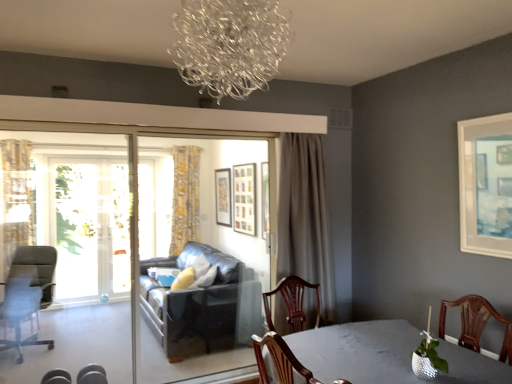
What is the approximate height of black leather couch at center, which is the 2th screen door in front-to-back order?

black leather couch at center, which is the 2th screen door in front-to-back order, is 6.60 feet tall.

Find the location of `leather couch at center`. leather couch at center is located at coordinates (202, 305).

Measure the distance between point (255, 177) and camera.

A distance of 15.72 feet exists between point (255, 177) and camera.

How much space does transparent glass screen door at left, which is counted as the 2th screen door, starting from the left, occupy vertically?

1.90 meters.

Identify the location of black leather couch at center, which is the 2th screen door in front-to-back order. (199, 258).

Which is more to the right, matte black chair at lower left, which is counted as the 2th chair, starting from the left, or yellow floral fabric curtain at left, positioned as the 3th curtain in right-to-left order?

Positioned to the right is matte black chair at lower left, which is counted as the 2th chair, starting from the left.

Where is `chair that is the 2nd object located below the yellow floral fabric curtain at left, positioned as the 3th curtain in right-to-left order (from the image's perspective)`? This screenshot has width=512, height=384. chair that is the 2nd object located below the yellow floral fabric curtain at left, positioned as the 3th curtain in right-to-left order (from the image's perspective) is located at coordinates (56, 377).

From the image's perspective, is matte black chair at lower left, placed as the second chair when sorted from right to left, on yellow floral fabric curtain at left, which appears as the second curtain when viewed from the back?

No, from the image's perspective, matte black chair at lower left, placed as the second chair when sorted from right to left, is not over yellow floral fabric curtain at left, which appears as the second curtain when viewed from the back.

Does point (45, 379) appear closer or farther from the camera than point (10, 155)?

Point (45, 379) appears to be closer to the viewer than point (10, 155).

Is wooden picture frame at center, which is the 2th picture frame in front-to-back order, far away from black leather couch at center, marked as the 1th screen door in a right-to-left arrangement?

That's right, there is a large distance between wooden picture frame at center, which is the 2th picture frame in front-to-back order, and black leather couch at center, marked as the 1th screen door in a right-to-left arrangement.

Is wooden picture frame at center, which is the 2th picture frame in front-to-back order, taller than black leather couch at center, the second screen door from the back?

No.

From the image's perspective, between wooden picture frame at center, which ranks as the 2th picture frame in right-to-left order, and black leather couch at center, the second screen door from the back, who is located below?

black leather couch at center, the second screen door from the back, appears lower in the image.

Is wooden picture frame at center, the 3th picture frame from the left, to the right of black leather couch at center, which is the 2th screen door in front-to-back order, from the viewer's perspective?

Indeed, wooden picture frame at center, the 3th picture frame from the left, is positioned on the right side of black leather couch at center, which is the 2th screen door in front-to-back order.

Is gray fabric curtain at center, positioned as the 3th curtain in back-to-front order, with leather couch at center?

No, gray fabric curtain at center, positioned as the 3th curtain in back-to-front order, is not making contact with leather couch at center.

From the image's perspective, who appears lower, gray fabric curtain at center, placed as the first curtain when sorted from front to back, or leather couch at center?

leather couch at center is shown below in the image.

Which object is positioned more to the right, gray fabric curtain at center, placed as the first curtain when sorted from front to back, or leather couch at center?

gray fabric curtain at center, placed as the first curtain when sorted from front to back, is more to the right.

There is a leather couch at center. In order to click on the 1st curtain above it (from a real-world perspective) in this screenshot , I will do pos(305,218).

Which object is thinner, leather couch at center or shiny gray table at lower right?

leather couch at center is thinner.

Find the location of a particular element. table to the right of leather couch at center is located at coordinates (386, 355).

In the scene shown: How many degrees apart are the facing directions of leather couch at center and shiny gray table at lower right?

The facing directions of leather couch at center and shiny gray table at lower right are 1.53 degrees apart.

From the image's perspective, who appears lower, wooden picture frame at center, the 3th picture frame from the left, or metallic silver chair at lower left, the 2th chair from the back?

metallic silver chair at lower left, the 2th chair from the back, from the image's perspective.

From the picture: Would you say wooden picture frame at center, the 3th picture frame from the left, is inside or outside metallic silver chair at lower left, the 2th chair from the back?

wooden picture frame at center, the 3th picture frame from the left, is located beyond the bounds of metallic silver chair at lower left, the 2th chair from the back.

Where is `chair that is the 1st one when counting leftward from the wooden picture frame at center, which is the 2th picture frame in front-to-back order`? chair that is the 1st one when counting leftward from the wooden picture frame at center, which is the 2th picture frame in front-to-back order is located at coordinates (92, 375).

Considering the relative positions of wooden picture frame at center, acting as the third picture frame starting from the back, and metallic silver chair at lower left, the 2th chair from the back, in the image provided, is wooden picture frame at center, acting as the third picture frame starting from the back, to the left or to the right of metallic silver chair at lower left, the 2th chair from the back,?

Based on their positions, wooden picture frame at center, acting as the third picture frame starting from the back, is located to the right of metallic silver chair at lower left, the 2th chair from the back.

Is white matte picture frame at upper right, marked as the 4th picture frame in a back-to-front arrangement, in front of or behind wooden picture frame at center, which ranks as the 2th picture frame in right-to-left order, in the image?

Visually, white matte picture frame at upper right, marked as the 4th picture frame in a back-to-front arrangement, is located in front of wooden picture frame at center, which ranks as the 2th picture frame in right-to-left order.

Between white matte picture frame at upper right, the first picture frame in the front-to-back sequence, and wooden picture frame at center, which ranks as the 2th picture frame in right-to-left order, which one has larger size?

With larger size is wooden picture frame at center, which ranks as the 2th picture frame in right-to-left order.

Is point (477, 210) more distant than point (264, 169)?

No, it is in front of (264, 169).

From the image's perspective, does white matte picture frame at upper right, marked as the first picture frame in a right-to-left arrangement, appear lower than wooden picture frame at center, acting as the third picture frame starting from the back?

No, from the image's perspective, white matte picture frame at upper right, marked as the first picture frame in a right-to-left arrangement, is not beneath wooden picture frame at center, acting as the third picture frame starting from the back.

Is metallic silver chair at lower left, arranged as the 3th chair when viewed from the left, smaller than yellow floral fabric curtain at center, which is counted as the 1th curtain, starting from the back?

Correct, metallic silver chair at lower left, arranged as the 3th chair when viewed from the left, occupies less space than yellow floral fabric curtain at center, which is counted as the 1th curtain, starting from the back.

Consider the image. How far apart are metallic silver chair at lower left, which appears as the first chair when viewed from the right, and yellow floral fabric curtain at center, which ranks as the 2th curtain in left-to-right order?

metallic silver chair at lower left, which appears as the first chair when viewed from the right, is 3.30 meters away from yellow floral fabric curtain at center, which ranks as the 2th curtain in left-to-right order.

From a real-world perspective, which object stands above the other?

yellow floral fabric curtain at center, which ranks as the 2th curtain in left-to-right order.

Is metallic silver chair at lower left, which appears as the first chair when viewed from the right, beside yellow floral fabric curtain at center, which is counted as the 1th curtain, starting from the back?

No.

The width and height of the screenshot is (512, 384). Find the location of `curtain that is the 2nd object located behind the matte black chair at lower left, which is counted as the 2th chair, starting from the left`. curtain that is the 2nd object located behind the matte black chair at lower left, which is counted as the 2th chair, starting from the left is located at coordinates pyautogui.click(x=16, y=197).

Locate an element on the screen. The width and height of the screenshot is (512, 384). picture frame that is the 2nd one when counting rightward from the black leather couch at center, the second screen door from the back is located at coordinates (265, 200).

When comparing their distances from shiny gray table at lower right, does wooden picture frame at center, the 3th picture frame from the left, or transparent glass screen door at left, the third screen door positioned from the right, seem further?

transparent glass screen door at left, the third screen door positioned from the right, lies further to shiny gray table at lower right than the other object.

Looking at the image, which one is located closer to yellow floral fabric curtain at center, which is counted as the 1th curtain, starting from the back, transparent glass screen door at left, the first screen door in the back-to-front sequence, or matte black chair at lower left, the 1th chair from the front?

transparent glass screen door at left, the first screen door in the back-to-front sequence, is closer to yellow floral fabric curtain at center, which is counted as the 1th curtain, starting from the back.

Estimate the real-world distances between objects in this image. Which object is closer to yellow floral fabric curtain at center, which ranks as the 2th curtain in left-to-right order, wooden picture frame at center, the 3th picture frame in the right-to-left sequence, or metallic silver chair at lower left, arranged as the 3th chair when viewed from the left?

wooden picture frame at center, the 3th picture frame in the right-to-left sequence.

Looking at the image, which one is located further to yellow floral fabric curtain at left, which is counted as the second curtain, starting from the front, black leather couch at center, marked as the 1th screen door in a right-to-left arrangement, or yellow floral fabric curtain at center, which ranks as the 2th curtain in left-to-right order?

yellow floral fabric curtain at center, which ranks as the 2th curtain in left-to-right order.

Considering their positions, is black leather couch at center, marked as the 1th screen door in a right-to-left arrangement, positioned closer to transparent glass screen door at left, which is the 1th screen door in left-to-right order, than clear glass chandelier at upper center?

Based on the image, black leather couch at center, marked as the 1th screen door in a right-to-left arrangement, appears to be nearer to transparent glass screen door at left, which is the 1th screen door in left-to-right order.

Estimate the real-world distances between objects in this image. Which object is closer to matte black chair at lower left, the 1th chair from the front, gray fabric curtain at center, the first curtain viewed from the right, or matte black picture frame at center, which is counted as the 1th picture frame, starting from the left?

Based on the image, gray fabric curtain at center, the first curtain viewed from the right, appears to be nearer to matte black chair at lower left, the 1th chair from the front.

When comparing their distances from matte black picture frame at center, which is counted as the 1th picture frame, starting from the left, does clear glass chandelier at upper center or transparent glass screen door at left, which is counted as the 2th screen door, starting from the left, seem closer?

The object closer to matte black picture frame at center, which is counted as the 1th picture frame, starting from the left, is transparent glass screen door at left, which is counted as the 2th screen door, starting from the left.

Looking at the image, which one is located further to matte black picture frame at center, the first picture frame viewed from the back, clear glass chandelier at upper center or wooden picture frame at center, which is the 3th picture frame from front to back?

clear glass chandelier at upper center is further to matte black picture frame at center, the first picture frame viewed from the back.

I want to click on picture frame positioned between black leather couch at center, the second screen door from the back, and wooden picture frame at center, the 3th picture frame in the right-to-left sequence, from near to far, so click(265, 200).

The height and width of the screenshot is (384, 512). I want to click on curtain positioned between shiny gray table at lower right and wooden picture frame at center, which is the 3th picture frame from front to back, from near to far, so click(x=305, y=218).

This screenshot has height=384, width=512. I want to click on screen door between transparent glass screen door at left, which is the second screen door in right-to-left order, and gray fabric curtain at center, which is the third curtain from left to right, in the horizontal direction, so click(x=199, y=258).

The width and height of the screenshot is (512, 384). I want to click on picture frame between wooden picture frame at center, which is the 3th picture frame from front to back, and yellow floral fabric curtain at center, which ranks as the 2th curtain in right-to-left order, from front to back, so tap(223, 197).